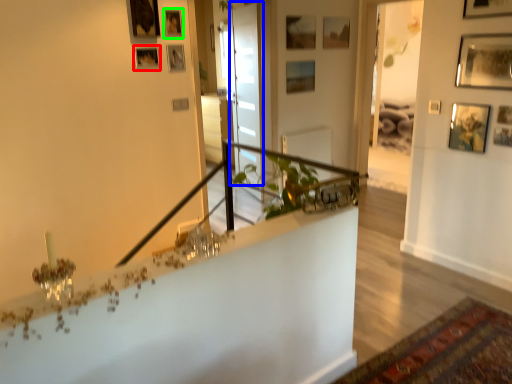
Question: Which is farther away from picture frame (highlighted by a red box)? glass door (highlighted by a blue box) or picture frame (highlighted by a green box)?

Choices:
 (A) glass door
 (B) picture frame

Answer: (A)